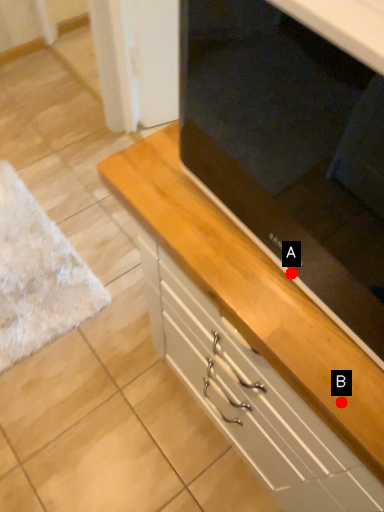
Question: Two points are circled on the image, labeled by A and B beside each circle. Which point is further to the camera?

Choices:
 (A) A is further
 (B) B is further

Answer: (A)